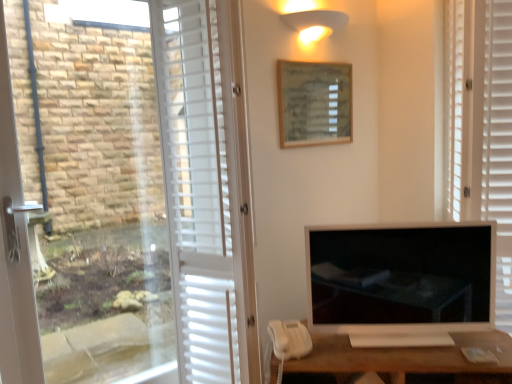
Where is `free point to the right of white matte corded phone at lower center`? The height and width of the screenshot is (384, 512). free point to the right of white matte corded phone at lower center is located at coordinates (336, 348).